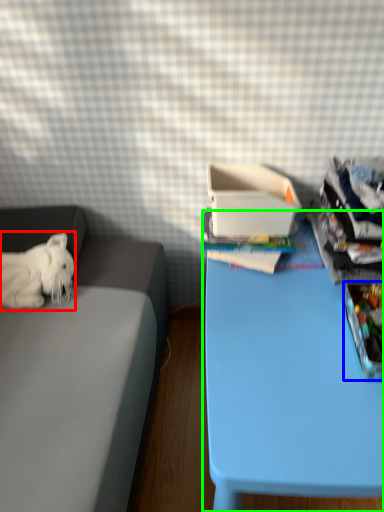
Question: Estimate the real-world distances between objects in this image. Which object is closer to dog (highlighted by a red box), storage box (highlighted by a blue box) or table (highlighted by a green box)?

Choices:
 (A) storage box
 (B) table

Answer: (B)